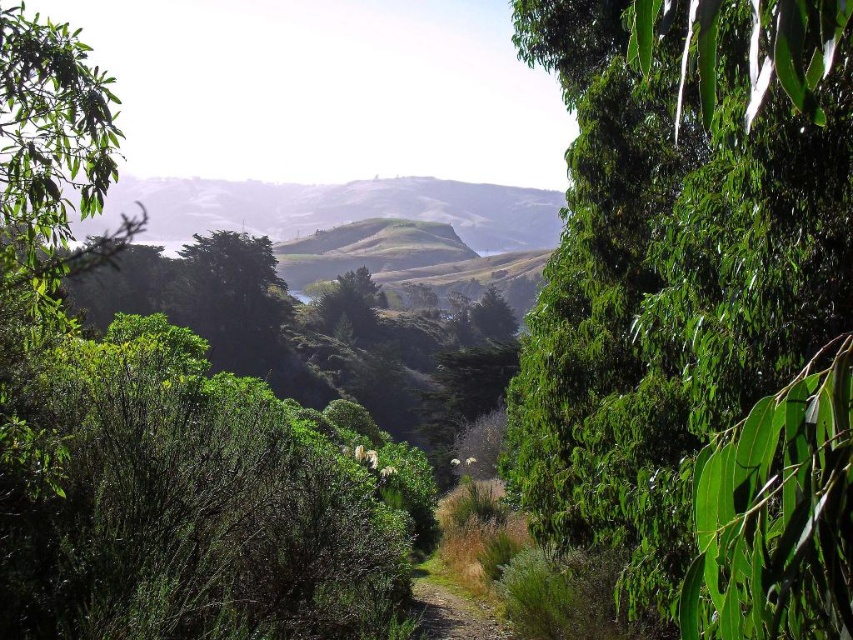
Question: Does green leafy tree at center appear over green leafy tree at left?

Choices:
 (A) no
 (B) yes

Answer: (A)

Question: Which point is farther to the camera?

Choices:
 (A) (9, 38)
 (B) (579, 208)

Answer: (B)

Question: Is green leafy tree at left positioned before gravel path at center?

Choices:
 (A) no
 (B) yes

Answer: (B)

Question: Does green leafy tree at center come in front of gravel path at center?

Choices:
 (A) no
 (B) yes

Answer: (B)

Question: Based on their relative distances, which object is farther from the gravel path at center?

Choices:
 (A) green leafy tree at center
 (B) green leafy tree at left

Answer: (B)

Question: Which object is closer to the camera taking this photo?

Choices:
 (A) green leafy tree at left
 (B) green leafy tree at center

Answer: (B)